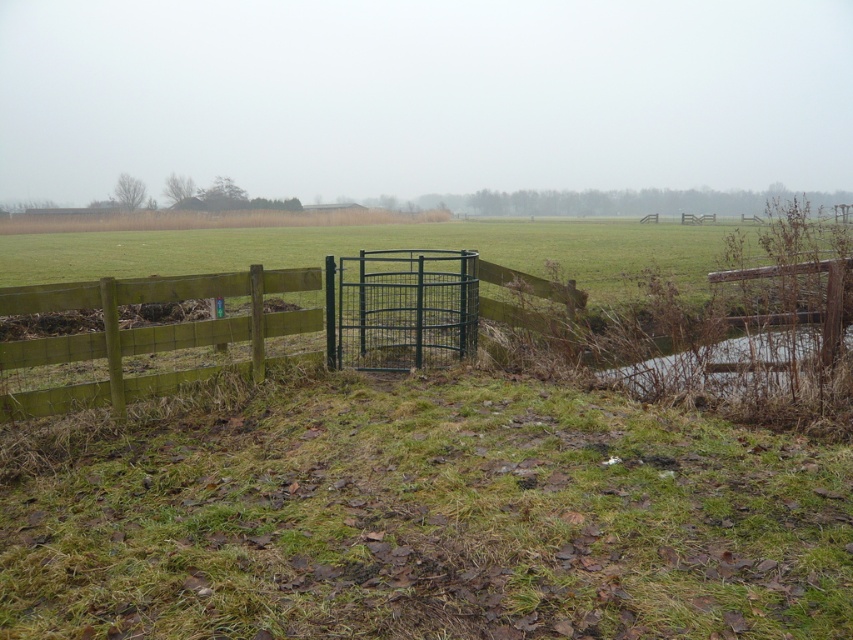
Question: Is green wooden fence at left to the right of green wire cage at center from the viewer's perspective?

Choices:
 (A) no
 (B) yes

Answer: (A)

Question: In this image, where is green wooden fence at left located relative to green wire cage at center?

Choices:
 (A) right
 (B) left

Answer: (B)

Question: Does green wooden fence at left appear on the left side of green wire cage at center?

Choices:
 (A) yes
 (B) no

Answer: (A)

Question: Which object appears farthest from the camera in this image?

Choices:
 (A) green wooden fence at left
 (B) green wire cage at center

Answer: (B)